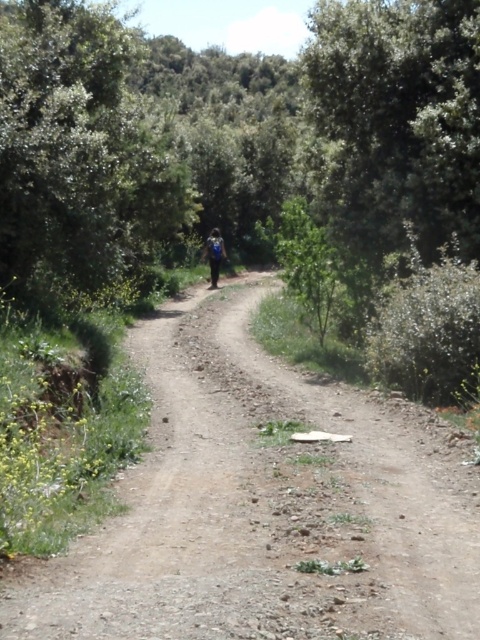
Question: Observing the image, what is the correct spatial positioning of dirt road at center in reference to green leafy tree at upper left?

Choices:
 (A) left
 (B) right

Answer: (B)

Question: Which point appears closest to the camera in this image?

Choices:
 (A) (159, 147)
 (B) (335, 604)

Answer: (B)

Question: Can you confirm if dirt road at center is thinner than green leafy tree at upper left?

Choices:
 (A) no
 (B) yes

Answer: (B)

Question: Can you confirm if dirt road at center is bigger than green leafy tree at upper left?

Choices:
 (A) yes
 (B) no

Answer: (B)

Question: Which point is farther from the camera taking this photo?

Choices:
 (A) (124, 620)
 (B) (78, 214)

Answer: (B)